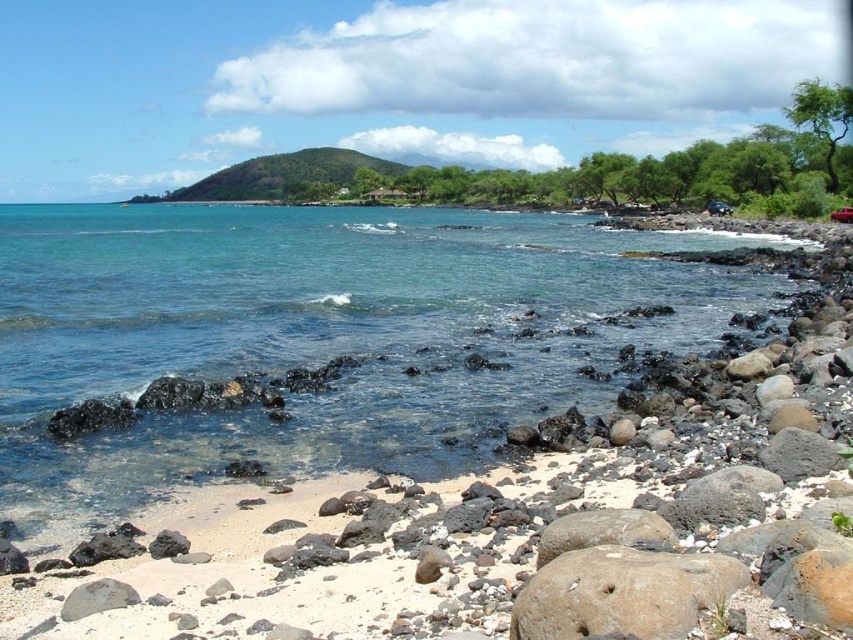
Question: Is brown rough rock at lower right to the left of green grassy hill at center from the viewer's perspective?

Choices:
 (A) yes
 (B) no

Answer: (B)

Question: Can you confirm if brown rough rock at lower right is wider than green grassy hill at center?

Choices:
 (A) no
 (B) yes

Answer: (A)

Question: Considering the real-world distances, which object is closest to the green grassy hill at center?

Choices:
 (A) clear blue water at center
 (B) brown rough rock at lower right

Answer: (A)

Question: Estimate the real-world distances between objects in this image. Which object is farther from the green grassy hill at center?

Choices:
 (A) brown rough rock at lower right
 (B) clear blue water at center

Answer: (A)

Question: Does clear blue water at center have a larger size compared to brown rough rock at lower right?

Choices:
 (A) no
 (B) yes

Answer: (B)

Question: Which point is farther to the camera?

Choices:
 (A) clear blue water at center
 (B) green grassy hill at center

Answer: (B)